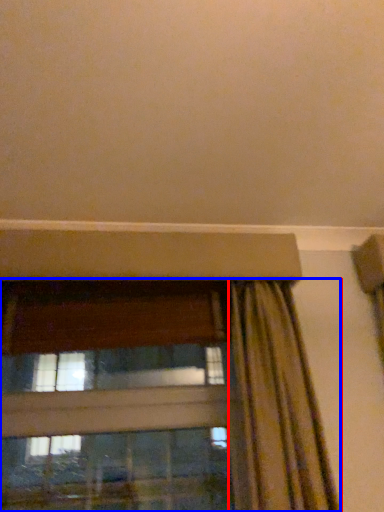
Question: Which object is further to the camera taking this photo, curtain (highlighted by a red box) or window (highlighted by a blue box)?

Choices:
 (A) curtain
 (B) window

Answer: (B)